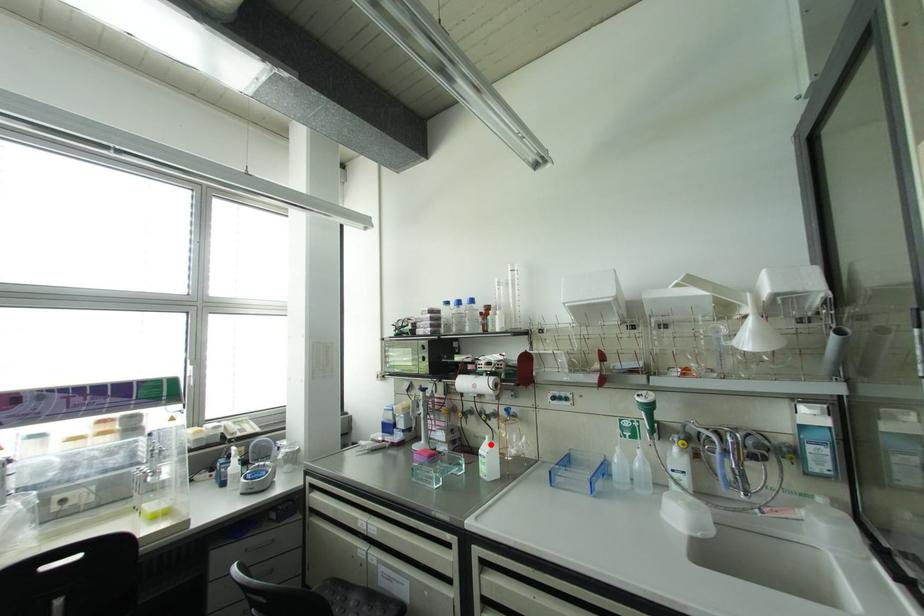
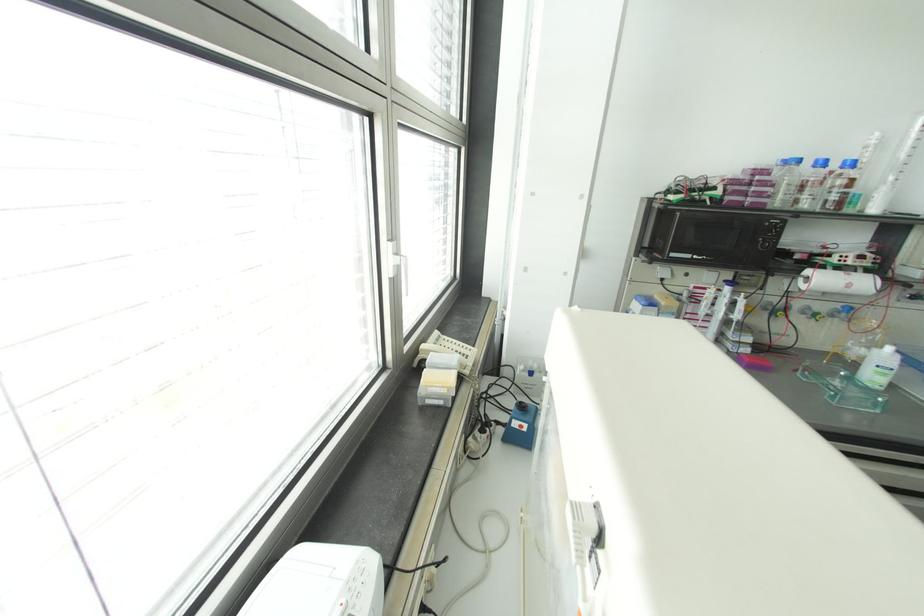
Question: I am providing you with two images of the same scene from different viewpoints. Image1 has a red point marked. In image2, the corresponding 3D location appears at what relative position? Reply with the corresponding letter.

Choices:
 (A) Closer
 (B) Farther

Answer: (A)